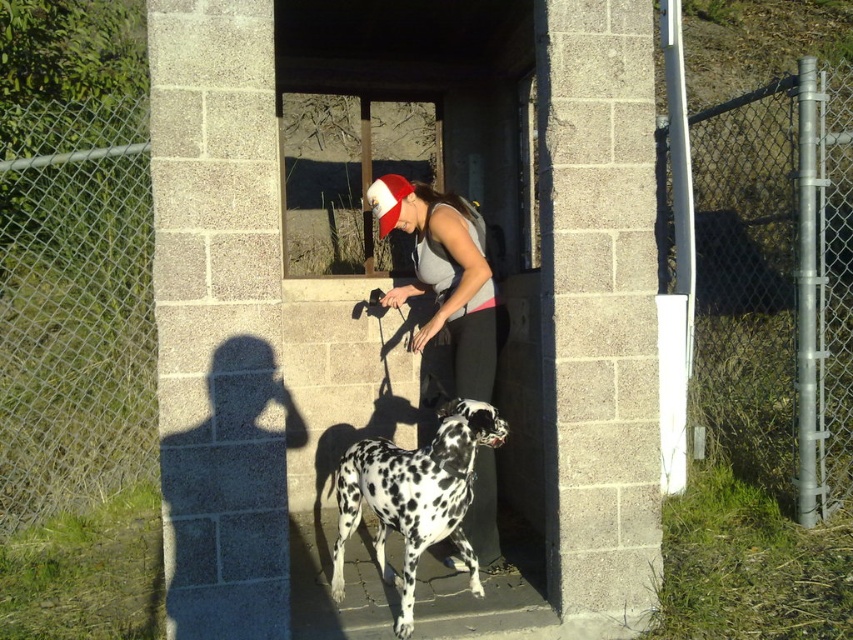
Question: Which of the following is the closest to the observer?

Choices:
 (A) (703, 244)
 (B) (474, 561)
 (C) (129, 432)
 (D) (401, 189)

Answer: (B)

Question: Which point appears farthest from the camera in this image?

Choices:
 (A) click(x=93, y=282)
 (B) click(x=850, y=372)
 (C) click(x=374, y=214)
 (D) click(x=490, y=477)

Answer: (A)

Question: Considering the relative positions of matte gray tank top at center and red fabric christmas hat at center in the image provided, where is matte gray tank top at center located with respect to red fabric christmas hat at center?

Choices:
 (A) right
 (B) left

Answer: (A)

Question: Which point is farther to the camera?

Choices:
 (A) metal chain-link fence at left
 (B) metallic chain-link fence at right
 (C) red fabric christmas hat at center

Answer: (A)

Question: Observing the image, what is the correct spatial positioning of metallic chain-link fence at right in reference to white-spotted fur dog at center?

Choices:
 (A) right
 (B) left

Answer: (A)

Question: Where is white-spotted fur dog at center located in relation to red fabric christmas hat at center in the image?

Choices:
 (A) left
 (B) right

Answer: (B)